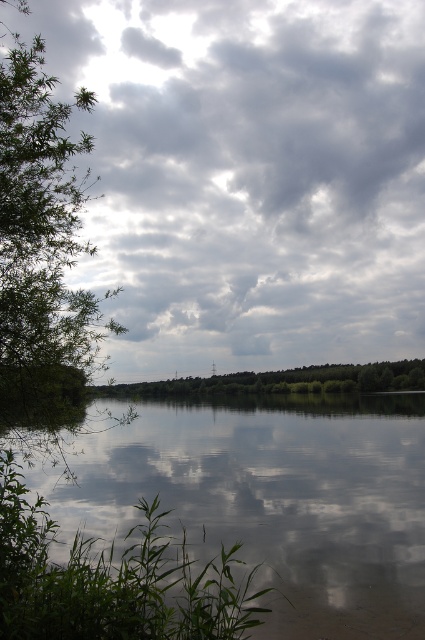
Question: Is cloudy sky at upper center below green leafy trees at center?

Choices:
 (A) yes
 (B) no

Answer: (B)

Question: Which of the following is the farthest from the observer?

Choices:
 (A) green leafy tree at left
 (B) smooth reflective water at center
 (C) green leafy trees at center
 (D) cloudy sky at upper center

Answer: (C)

Question: Can you confirm if smooth reflective water at center is thinner than green leafy tree at left?

Choices:
 (A) no
 (B) yes

Answer: (A)

Question: From the image, what is the correct spatial relationship of cloudy sky at upper center in relation to green leafy trees at center?

Choices:
 (A) above
 (B) below

Answer: (A)

Question: Which object appears farthest from the camera in this image?

Choices:
 (A) cloudy sky at upper center
 (B) green leafy trees at center

Answer: (B)

Question: Estimate the real-world distances between objects in this image. Which object is closer to the green leafy trees at center?

Choices:
 (A) green leafy tree at left
 (B) cloudy sky at upper center

Answer: (A)